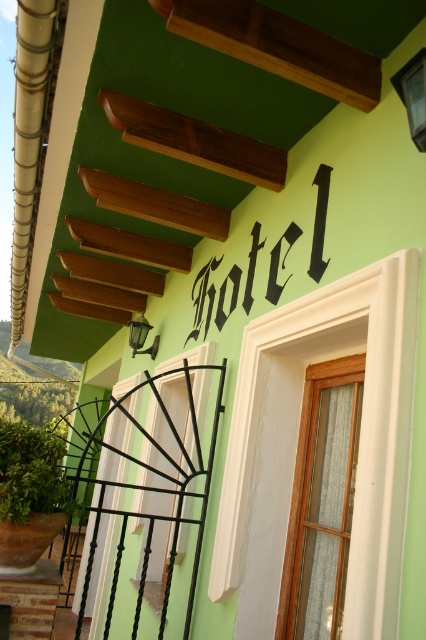
You are standing in front of the light green building and want to touch both points mentioned. Which point should you reach for first, the point at coordinate (x=25, y=467) or the point at coordinate (x=420, y=51)?

You should reach for the point at coordinate (x=25, y=467) first because it is closer to you than the point at coordinate (x=420, y=51).

You are standing in front of the hotel entrance and want to place a small decorative item between the black wrought iron at center and the green leafy plant at lower left. The item is 3.5 feet long. Will it fit in the space between them?

The distance between the black wrought iron at center and the green leafy plant at lower left is 4.05 feet, so the 3.5 feet long item will fit comfortably in the space between them.